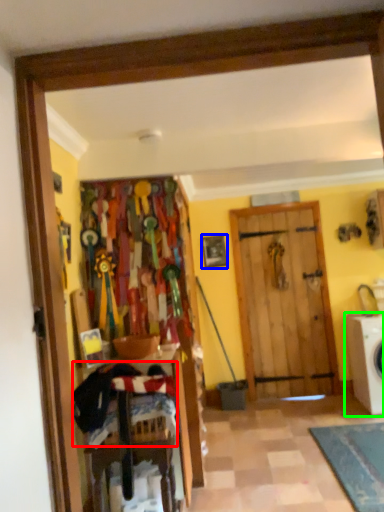
Question: Which is nearer to the laundry (highlighted by a red box)? picture frame (highlighted by a blue box) or washing machine (highlighted by a green box).

Choices:
 (A) picture frame
 (B) washing machine

Answer: (B)